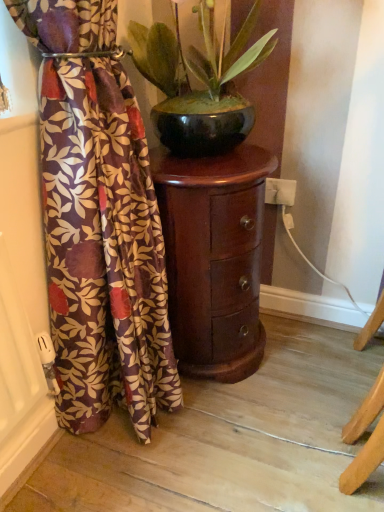
Question: Does velvet floral curtain at left have a lesser height compared to glossy ceramic pot at center?

Choices:
 (A) yes
 (B) no

Answer: (B)

Question: Is the depth of velvet floral curtain at left less than that of glossy ceramic pot at center?

Choices:
 (A) yes
 (B) no

Answer: (A)

Question: From the image's perspective, is velvet floral curtain at left located above glossy ceramic pot at center?

Choices:
 (A) yes
 (B) no

Answer: (B)

Question: Considering the relative sizes of velvet floral curtain at left and glossy ceramic pot at center in the image provided, is velvet floral curtain at left bigger than glossy ceramic pot at center?

Choices:
 (A) yes
 (B) no

Answer: (A)

Question: Is glossy ceramic pot at center surrounded by velvet floral curtain at left?

Choices:
 (A) no
 (B) yes

Answer: (A)

Question: Can you confirm if velvet floral curtain at left is positioned to the right of glossy ceramic pot at center?

Choices:
 (A) no
 (B) yes

Answer: (A)

Question: Can you confirm if velvet floral curtain at left is positioned to the left of mahogany wood side table at center?

Choices:
 (A) yes
 (B) no

Answer: (A)

Question: Is velvet floral curtain at left taller than mahogany wood side table at center?

Choices:
 (A) no
 (B) yes

Answer: (B)

Question: From a real-world perspective, is velvet floral curtain at left physically above mahogany wood side table at center?

Choices:
 (A) yes
 (B) no

Answer: (A)

Question: Is velvet floral curtain at left smaller than mahogany wood side table at center?

Choices:
 (A) yes
 (B) no

Answer: (B)

Question: Is mahogany wood side table at center surrounded by velvet floral curtain at left?

Choices:
 (A) yes
 (B) no

Answer: (B)

Question: Considering the relative positions of velvet floral curtain at left and mahogany wood side table at center in the image provided, is velvet floral curtain at left in front of mahogany wood side table at center?

Choices:
 (A) yes
 (B) no

Answer: (A)

Question: Can you see glossy ceramic pot at center touching velvet floral curtain at left?

Choices:
 (A) yes
 (B) no

Answer: (B)